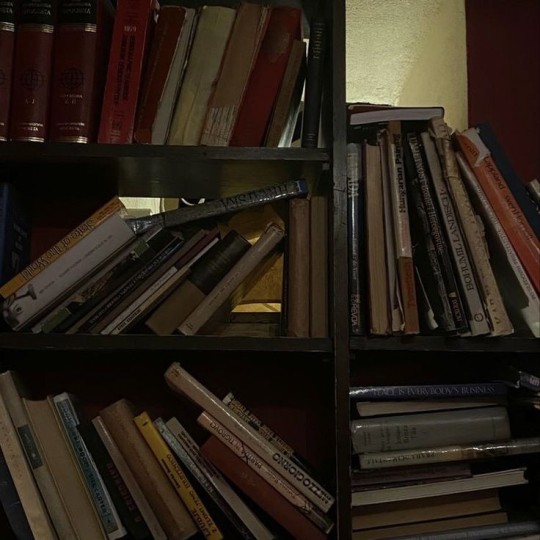
Find the location of a particular element. many books is located at coordinates (237, 460), (443, 453), (440, 270), (218, 262), (216, 89).